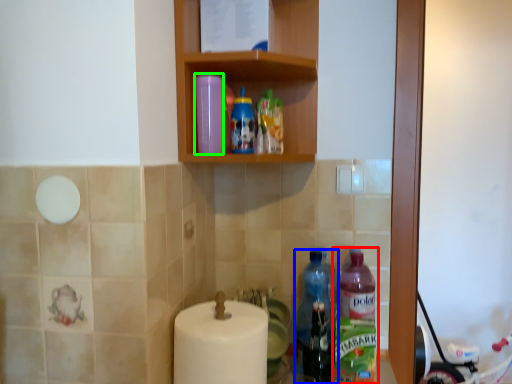
Question: Based on their relative distances, which object is nearer to bottle (highlighted by a red box)? Choose from bottle (highlighted by a blue box) and bottle (highlighted by a green box).

Choices:
 (A) bottle
 (B) bottle

Answer: (A)